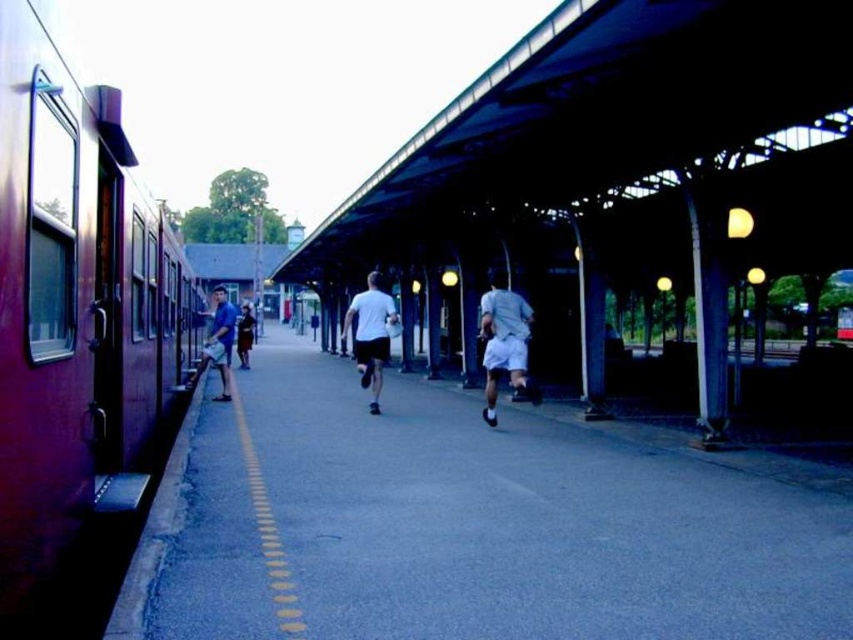
You are standing at the train station and see a person wearing a white matte shirt at center. If you want to approach them, which direction should you move from your current position at the yellow dotted line on the platform edge?

To approach the white matte shirt at center from the yellow dotted line on the platform edge, you should move towards the center of the platform since the white matte shirt at center is located at point (x=370, y=333), which is away from the edge marked by the yellow dotted line.

You are a passenger waiting on the train platform. You see a white matte shirt at center and a blue cotton shirt at left. Which shirt is nearer to you?

The white matte shirt at center is closer to the viewer than the blue cotton shirt at left, so the white matte shirt at center is nearer to you.